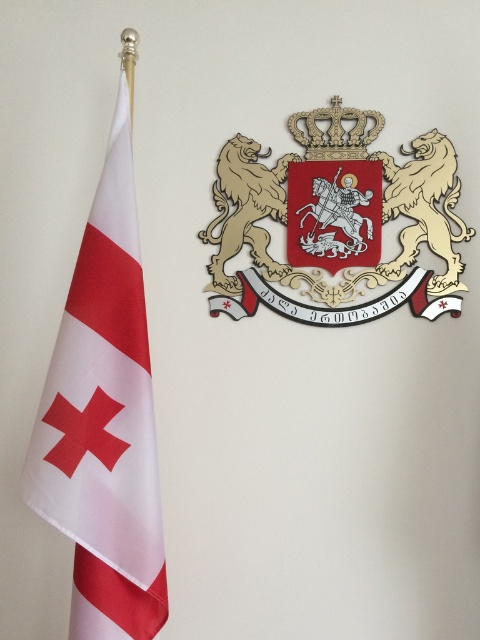
Is white fabric flag at left further to camera compared to gold textured coat of arms at upper right?

No, white fabric flag at left is in front of gold textured coat of arms at upper right.

Who is taller, white fabric flag at left or gold textured coat of arms at upper right?

Standing taller between the two is white fabric flag at left.

Image resolution: width=480 pixels, height=640 pixels. What are the coordinates of `white fabric flag at left` in the screenshot? It's located at (104, 420).